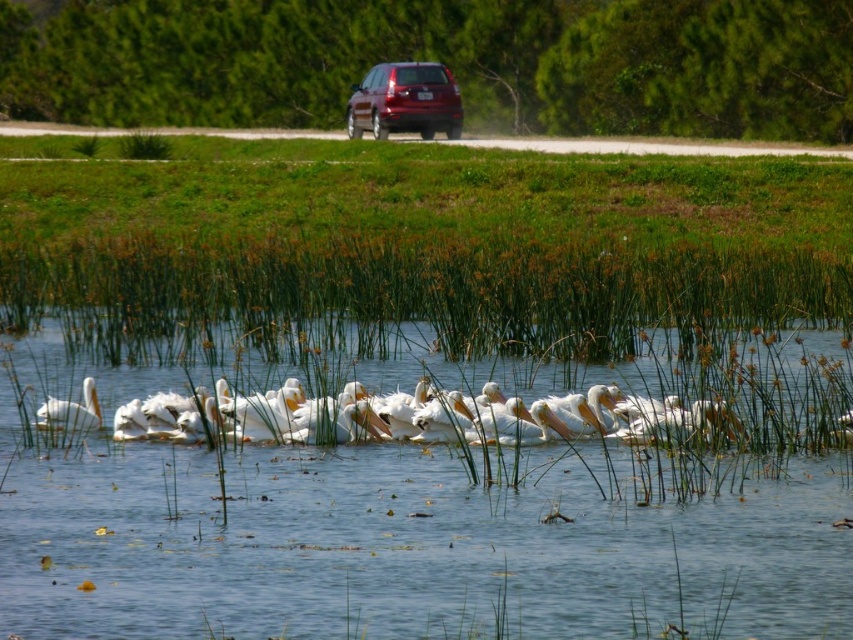
Does clear water at center come behind shiny red suv at center?

No, it is in front of shiny red suv at center.

Is point (834, 353) behind point (413, 72)?

That is False.

What do you see at coordinates (410, 545) in the screenshot? I see `clear water at center` at bounding box center [410, 545].

You are a GUI agent. You are given a task and a screenshot of the screen. Output one action in this format:
    pyautogui.click(x=<x>, y=<y>)
    Task: Click on the clear water at center
    The height and width of the screenshot is (640, 853).
    Given the screenshot: What is the action you would take?
    pyautogui.click(x=410, y=545)

Does point (779, 564) come in front of point (88, 429)?

Yes, point (779, 564) is closer to viewer.

Can you confirm if clear water at center is wider than white matte pelican at left?

Yes, clear water at center is wider than white matte pelican at left.

Where is `clear water at center`? clear water at center is located at coordinates (410, 545).

Can you confirm if shiny red suv at center is smaller than white matte pelican at left?

Yes.

Can you confirm if shiny red suv at center is wider than white matte pelican at left?

In fact, shiny red suv at center might be narrower than white matte pelican at left.

Does point (422, 77) come behind point (78, 420)?

That is True.

Image resolution: width=853 pixels, height=640 pixels. In order to click on shiny red suv at center in this screenshot , I will do `click(405, 100)`.